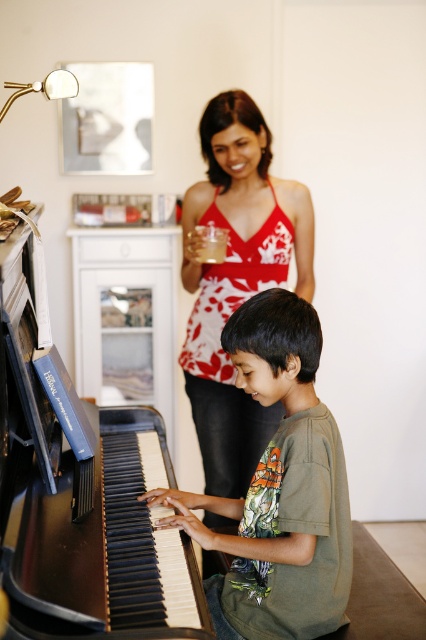
You are a photographer planning to take a photo of the black polished piano at left and the green cotton shirt at center. Since you want to emphasize the size difference between them, which object should you position closer to the camera to achieve this effect?

To emphasize the size difference between the black polished piano at left and the green cotton shirt at center, you should position the green cotton shirt at center closer to the camera. Since the black polished piano at left is already larger in size, bringing the smaller green cotton shirt at center nearer will make them appear more comparable in the photo.

You are a visitor standing in the room and want to approach the black polished piano at left. The average step length for a person is 28 inches. How many steps do you need to take to reach the piano?

The black polished piano at left is 37.40 inches away from the viewer. Since each step is 28 inches, you would need to take 2 steps to reach the piano because 28 inches is less than 37.40 inches, but 1 step would only cover 28 inches, so 2 steps are needed to cover the distance.

You are standing in the room and want to place a small plant between the two points, point (134,605) and point (218,180). Which point should the plant be closer to if you want it to appear larger in the photo?

The plant should be placed closer to point (134,605) because it is closer to the camera than point (218,180), making it appear larger in the photo.